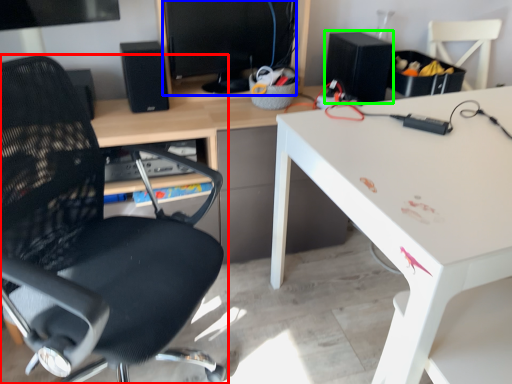
Question: Which is farther away from chair (highlighted by a red box)? computer monitor (highlighted by a blue box) or speaker (highlighted by a green box)?

Choices:
 (A) computer monitor
 (B) speaker

Answer: (B)